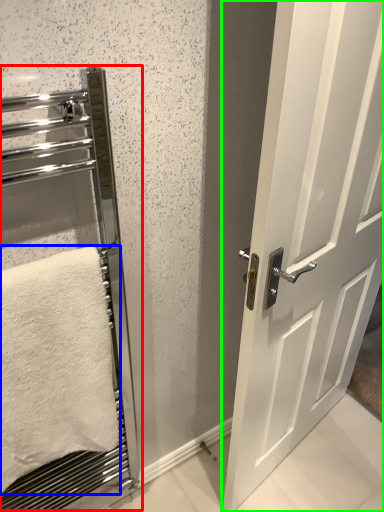
Question: Which object is positioned closest to elevator (highlighted by a red box)? Select from towel (highlighted by a blue box) and door (highlighted by a green box).

Choices:
 (A) towel
 (B) door

Answer: (A)